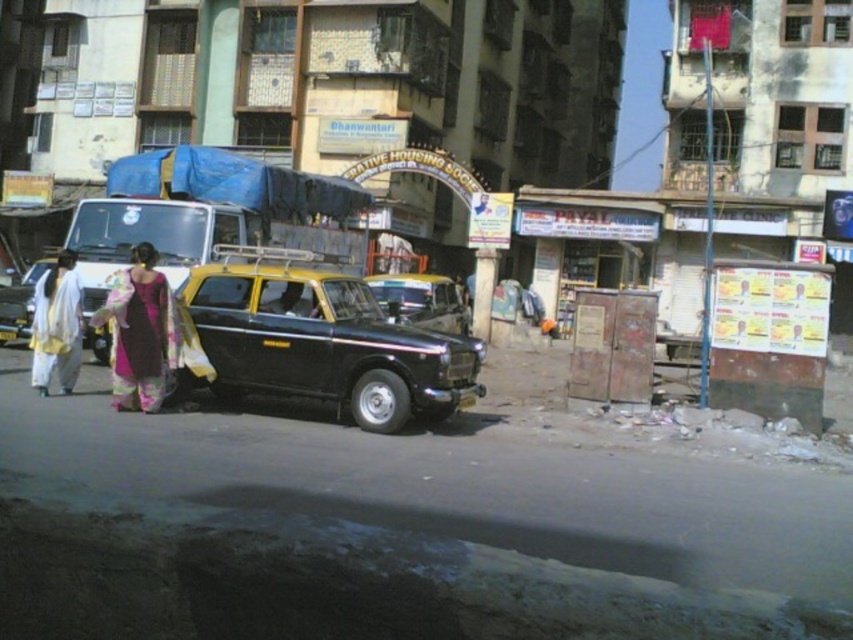
Question: Estimate the real-world distances between objects in this image. Which object is farther from the silky purple saree at center?

Choices:
 (A) black matte taxi at center
 (B) yellow matte taxi at center
 (C) white cotton saree at left

Answer: (B)

Question: Is silky purple saree at center bigger than white cotton saree at left?

Choices:
 (A) no
 (B) yes

Answer: (B)

Question: Estimate the real-world distances between objects in this image. Which object is closer to the white cotton saree at left?

Choices:
 (A) black matte taxi at center
 (B) silky purple saree at center
 (C) yellow matte taxi at center

Answer: (B)

Question: Is white cotton saree at left behind yellow matte taxi at center?

Choices:
 (A) no
 (B) yes

Answer: (A)

Question: Does silky purple saree at center have a larger size compared to white cotton saree at left?

Choices:
 (A) yes
 (B) no

Answer: (A)

Question: Which object appears farthest from the camera in this image?

Choices:
 (A) silky purple saree at center
 (B) white cotton saree at left

Answer: (B)